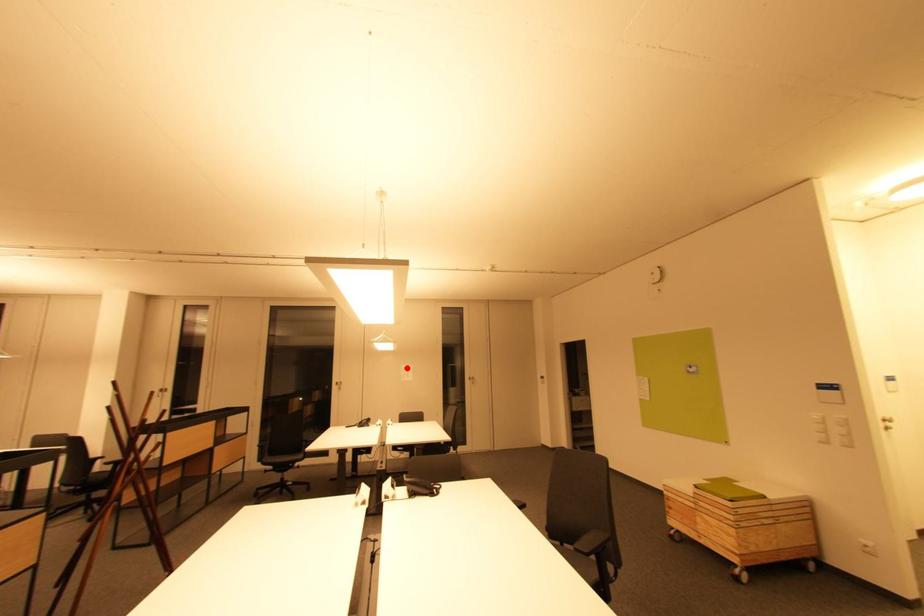
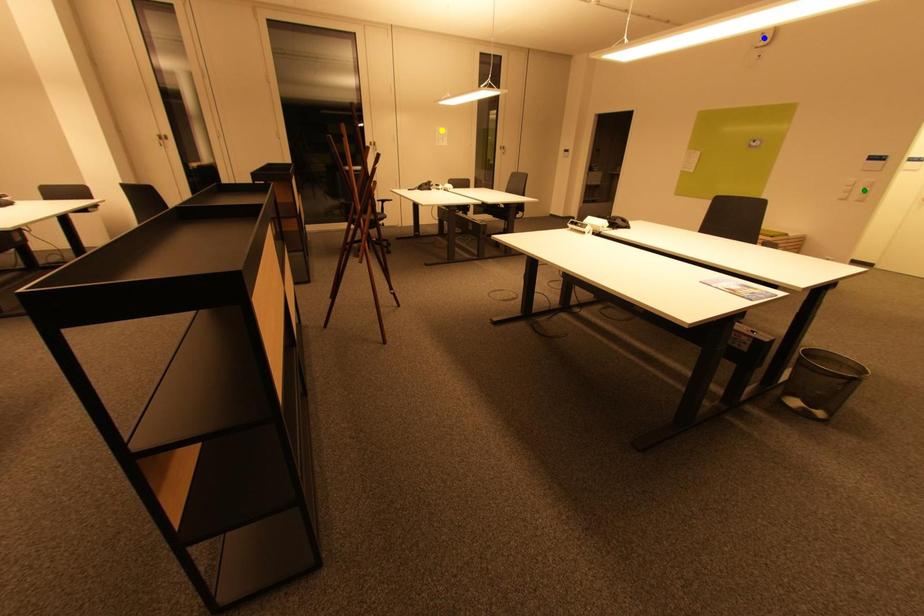
Question: I am providing you with two images of the same scene from different viewpoints. A red point is marked on the first image. You are given multiple points on the second image. Can you choose the point in image 2 that corresponds to the point in image 1?

Choices:
 (A) green point
 (B) yellow point
 (C) blue point

Answer: (B)